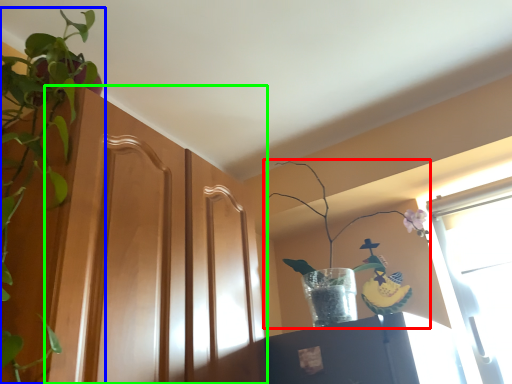
Question: Which object is the closest to the houseplant (highlighted by a red box)? Choose among these: houseplant (highlighted by a blue box) or screen door (highlighted by a green box).

Choices:
 (A) houseplant
 (B) screen door

Answer: (B)